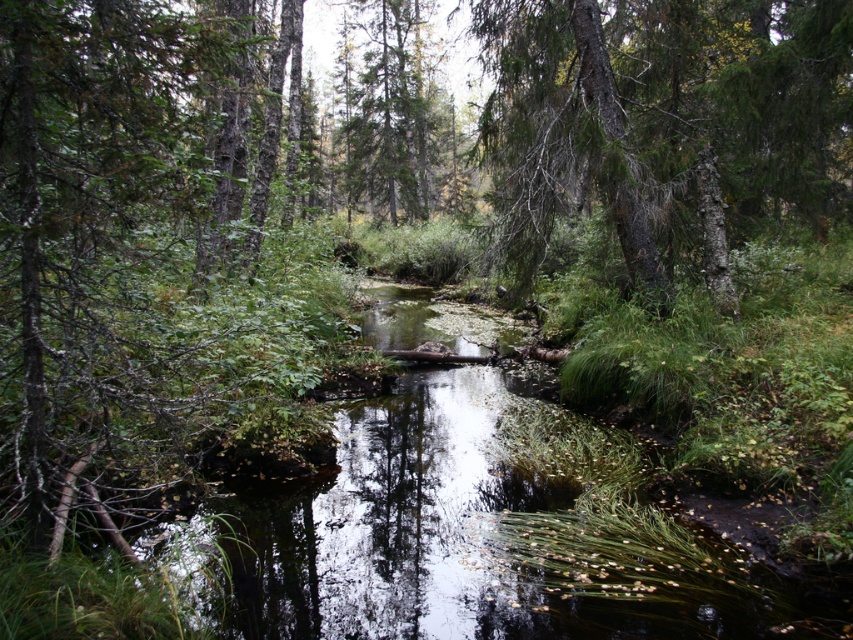
Is clear water at center positioned behind green textured tree at upper center?

That is False.

From the picture: Which of these two, clear water at center or green textured tree at upper center, stands shorter?

Standing shorter between the two is clear water at center.

Is point (498, 614) less distant than point (587, 128)?

Yes, point (498, 614) is in front of point (587, 128).

Identify the location of clear water at center. The height and width of the screenshot is (640, 853). (469, 538).